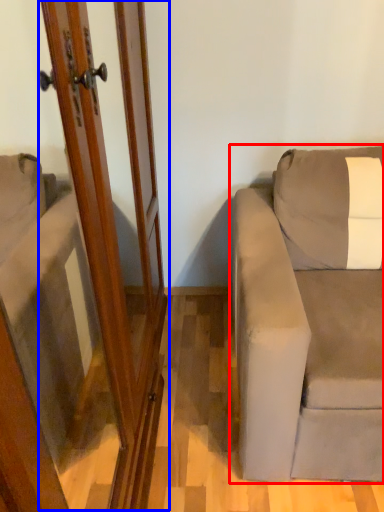
Question: Among these objects, which one is farthest to the camera, studio couch (highlighted by a red box) or screen door (highlighted by a blue box)?

Choices:
 (A) studio couch
 (B) screen door

Answer: (A)